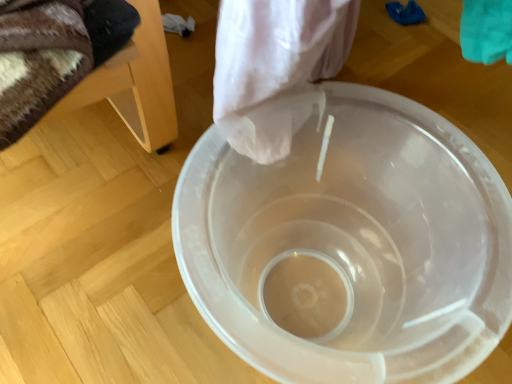
Question: From a real-world perspective, is wooden chair at left on top of transparent plastic bucket at center?

Choices:
 (A) no
 (B) yes

Answer: (B)

Question: From the image's perspective, is wooden chair at left below transparent plastic bucket at center?

Choices:
 (A) no
 (B) yes

Answer: (A)

Question: From the image's perspective, is wooden chair at left above transparent plastic bucket at center?

Choices:
 (A) no
 (B) yes

Answer: (B)

Question: Does wooden chair at left lie in front of transparent plastic bucket at center?

Choices:
 (A) no
 (B) yes

Answer: (B)

Question: Is wooden chair at left taller than transparent plastic bucket at center?

Choices:
 (A) yes
 (B) no

Answer: (B)

Question: Does wooden chair at left turn towards transparent plastic bucket at center?

Choices:
 (A) yes
 (B) no

Answer: (A)

Question: Could you tell me if transparent plastic bucket at center is facing wooden chair at left?

Choices:
 (A) no
 (B) yes

Answer: (A)

Question: From a real-world perspective, is transparent plastic bucket at center below wooden chair at left?

Choices:
 (A) no
 (B) yes

Answer: (B)

Question: Is transparent plastic bucket at center facing away from wooden chair at left?

Choices:
 (A) no
 (B) yes

Answer: (A)

Question: Does transparent plastic bucket at center have a smaller size compared to wooden chair at left?

Choices:
 (A) yes
 (B) no

Answer: (B)

Question: Considering the relative sizes of transparent plastic bucket at center and wooden chair at left in the image provided, is transparent plastic bucket at center wider than wooden chair at left?

Choices:
 (A) no
 (B) yes

Answer: (B)

Question: Considering the relative sizes of transparent plastic bucket at center and wooden chair at left in the image provided, is transparent plastic bucket at center shorter than wooden chair at left?

Choices:
 (A) no
 (B) yes

Answer: (A)

Question: From the image's perspective, relative to transparent plastic bucket at center, is wooden chair at left above or below?

Choices:
 (A) below
 (B) above

Answer: (B)